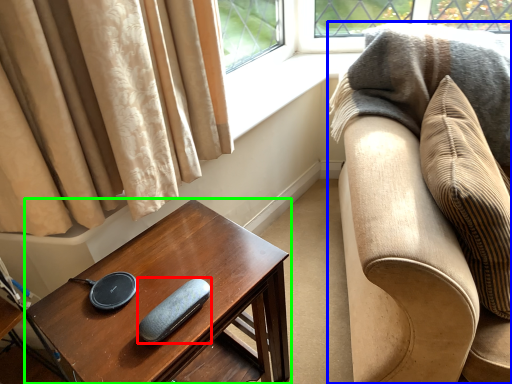
Question: Which object is positioned farthest from pad (highlighted by a red box)? Select from studio couch (highlighted by a blue box) and table (highlighted by a green box).

Choices:
 (A) studio couch
 (B) table

Answer: (A)